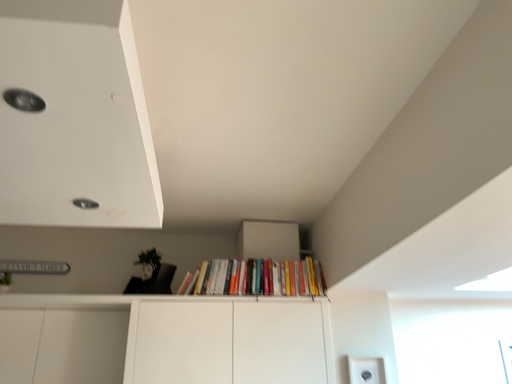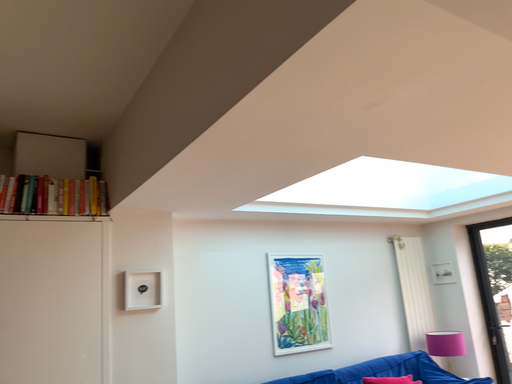
Question: Which way did the camera rotate in the video?

Choices:
 (A) rotated left
 (B) rotated right

Answer: (B)